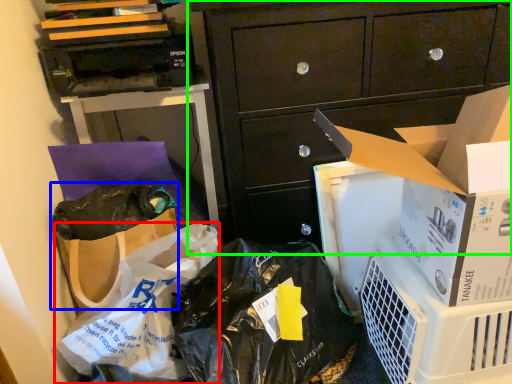
Question: Estimate the real-world distances between objects in this image. Which object is farther from plastic bag (highlighted by a red box), handbag (highlighted by a blue box) or cabinetry (highlighted by a green box)?

Choices:
 (A) handbag
 (B) cabinetry

Answer: (B)